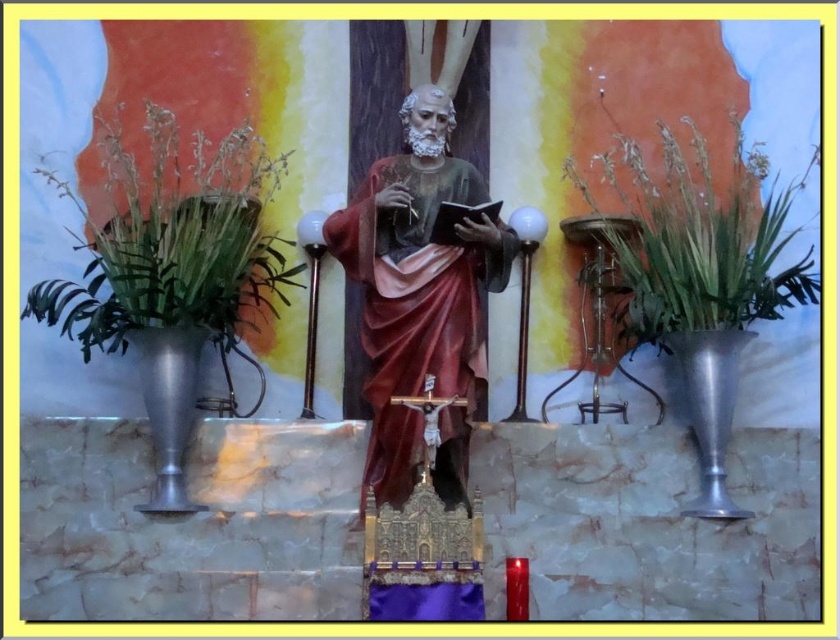
Does metallic vase at left appear on the left side of metallic vase at right?

Correct, you'll find metallic vase at left to the left of metallic vase at right.

At what (x,y) coordinates should I click in order to perform the action: click on metallic vase at left. Please return your answer as a coordinate pair (x, y). The width and height of the screenshot is (840, 640). Looking at the image, I should click on (172, 241).

At what (x,y) coordinates should I click in order to perform the action: click on metallic vase at left. Please return your answer as a coordinate pair (x, y). Looking at the image, I should click on (172, 241).

Can you confirm if matte wood statue at center is taller than metallic vase at right?

Indeed, matte wood statue at center has a greater height compared to metallic vase at right.

Is matte wood statue at center smaller than metallic vase at right?

Indeed, matte wood statue at center has a smaller size compared to metallic vase at right.

Is point (420, 230) behind point (693, 246)?

No, (420, 230) is in front of (693, 246).

I want to click on matte wood statue at center, so click(x=420, y=292).

Measure the distance between point [357,205] and camera.

Point [357,205] and camera are 186.58 feet apart from each other.

Can you confirm if matte wood statue at center is thinner than metallic vase at left?

Correct, matte wood statue at center's width is less than metallic vase at left's.

Between point (454, 308) and point (228, 298), which one is positioned in front?

Point (454, 308) is in front.

You are a GUI agent. You are given a task and a screenshot of the screen. Output one action in this format:
    pyautogui.click(x=<x>, y=<y>)
    Task: Click on the matte wood statue at center
    This screenshot has width=840, height=640.
    Given the screenshot: What is the action you would take?
    pyautogui.click(x=420, y=292)